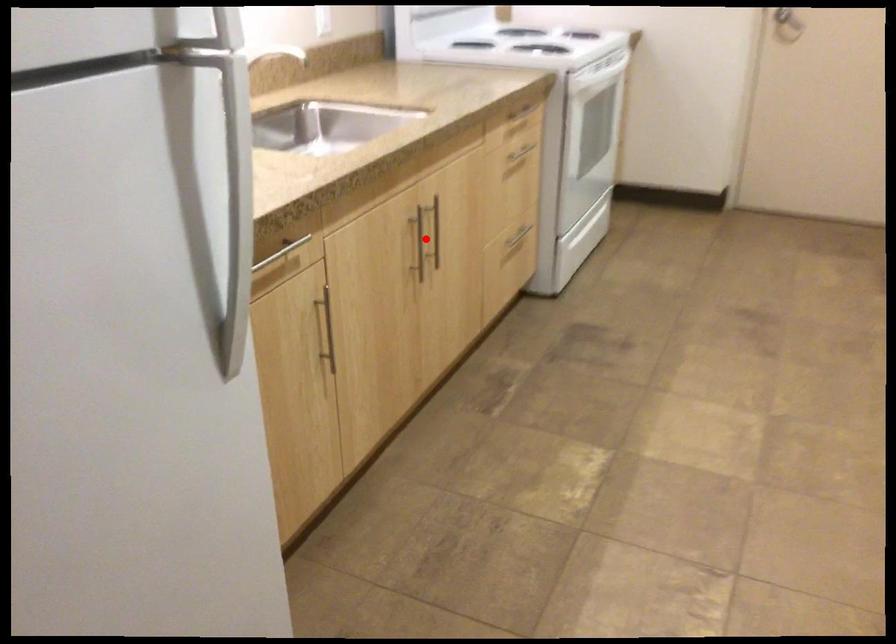
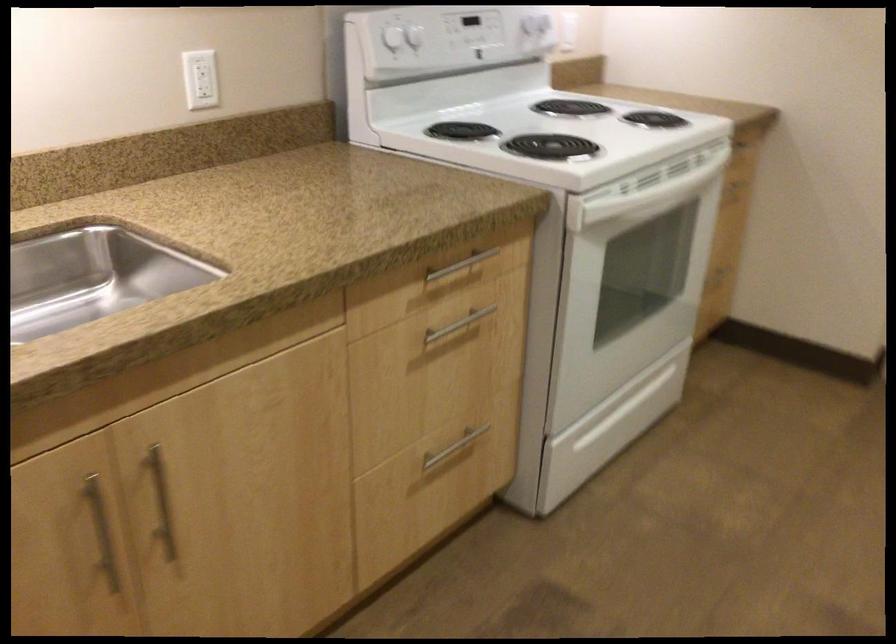
Where in the second image is the point corresponding to the highlighted location from the first image?

(161, 502)